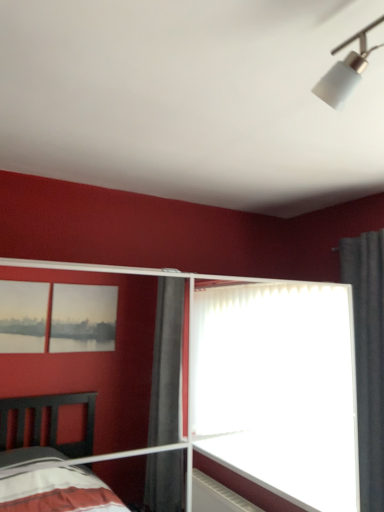
Question: From the image's perspective, is transparent glass door at center above or below gray fabric curtain at right?

Choices:
 (A) below
 (B) above

Answer: (A)

Question: Is transparent glass door at center in front of or behind gray fabric curtain at right in the image?

Choices:
 (A) behind
 (B) front

Answer: (B)

Question: Is transparent glass door at center spatially inside gray fabric curtain at right, or outside of it?

Choices:
 (A) outside
 (B) inside

Answer: (A)

Question: From the image's perspective, is gray fabric curtain at right above or below transparent glass door at center?

Choices:
 (A) below
 (B) above

Answer: (B)

Question: Does point (344, 276) appear closer or farther from the camera than point (342, 287)?

Choices:
 (A) closer
 (B) farther

Answer: (B)

Question: Considering the positions of gray fabric curtain at right and transparent glass door at center in the image, is gray fabric curtain at right bigger or smaller than transparent glass door at center?

Choices:
 (A) small
 (B) big

Answer: (A)

Question: Is gray fabric curtain at right in front of or behind transparent glass door at center in the image?

Choices:
 (A) front
 (B) behind

Answer: (B)